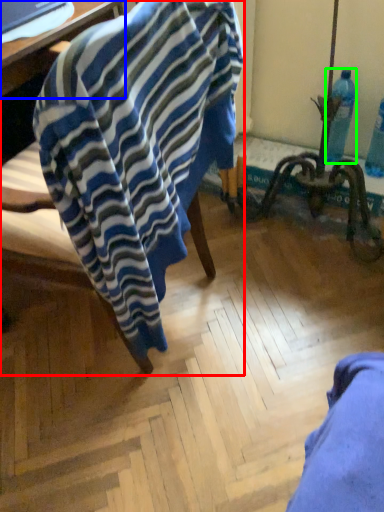
Question: Which object is positioned farthest from chair (highlighted by a red box)? Select from table (highlighted by a blue box) and bottle (highlighted by a green box).

Choices:
 (A) table
 (B) bottle

Answer: (B)